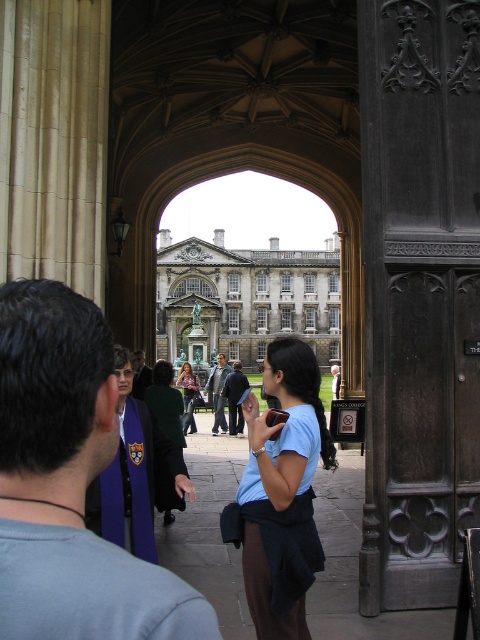
Question: From the image, what is the correct spatial relationship of dark green wool coat at center in relation to light blue shirt at center?

Choices:
 (A) above
 (B) below

Answer: (B)

Question: Which point appears farthest from the camera in this image?

Choices:
 (A) (187, 262)
 (B) (60, 497)
 (C) (153, 394)
 (D) (240, 365)

Answer: (A)

Question: From the image, what is the correct spatial relationship of light blue fabric shirt at center in relation to stone gray building at center?

Choices:
 (A) above
 (B) below

Answer: (B)

Question: Which of the following is the closest to the observer?

Choices:
 (A) stone gray building at center
 (B) light blue fabric shirt at center
 (C) blue fabric graduation gown at center
 (D) dark blue jeans at center

Answer: (C)

Question: Which of these objects is positioned closest to the blue fabric graduation gown at center?

Choices:
 (A) stone gray building at center
 (B) dark green wool coat at center
 (C) matte pink shirt at center
 (D) light blue fabric shirt at center

Answer: (D)

Question: Can you confirm if light blue fabric shirt at center is positioned to the left of stone gray building at center?

Choices:
 (A) yes
 (B) no

Answer: (B)